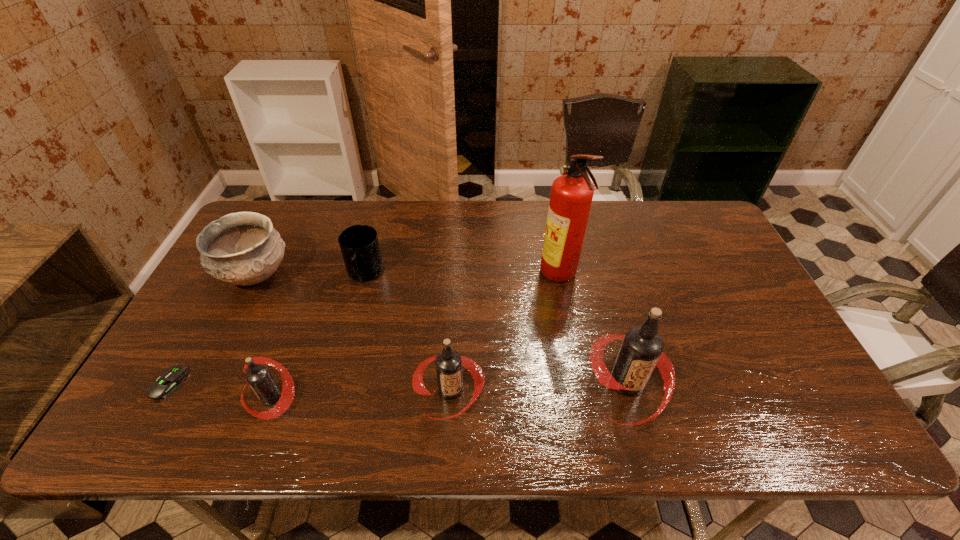
At what (x,y) coordinates should I click in order to perform the action: click on unoccupied area between the third object from left to right and the computer mouse. Please return your answer as a coordinate pair (x, y). This screenshot has height=540, width=960. Looking at the image, I should click on (219, 390).

Locate an element on the screen. The height and width of the screenshot is (540, 960). free space between the second shortest root beer and the fourth object from right to left is located at coordinates click(408, 332).

Identify the location of vacant area that lies between the second root beer from left to right and the shortest root beer. This screenshot has height=540, width=960. (361, 393).

Where is `empty space that is in between the shortest object and the pottery`? empty space that is in between the shortest object and the pottery is located at coordinates (211, 330).

This screenshot has height=540, width=960. Identify the location of vacant region between the shortest object and the third object from left to right. (219, 390).

What are the coordinates of `free space between the sixth shortest object and the fourth object from right to left` in the screenshot? It's located at (496, 329).

The height and width of the screenshot is (540, 960). I want to click on object that can be found as the sixth closest to the second root beer from left to right, so click(170, 379).

Where is `object that ranks as the closest to the pottery`? The height and width of the screenshot is (540, 960). object that ranks as the closest to the pottery is located at coordinates (359, 244).

The height and width of the screenshot is (540, 960). In order to click on root beer that stands as the second closest to the second shortest root beer in this screenshot , I will do `click(259, 378)`.

At what (x,y) coordinates should I click in order to perform the action: click on the second closest root beer to the third object from right to left. Please return your answer as a coordinate pair (x, y). Image resolution: width=960 pixels, height=540 pixels. Looking at the image, I should click on (259, 378).